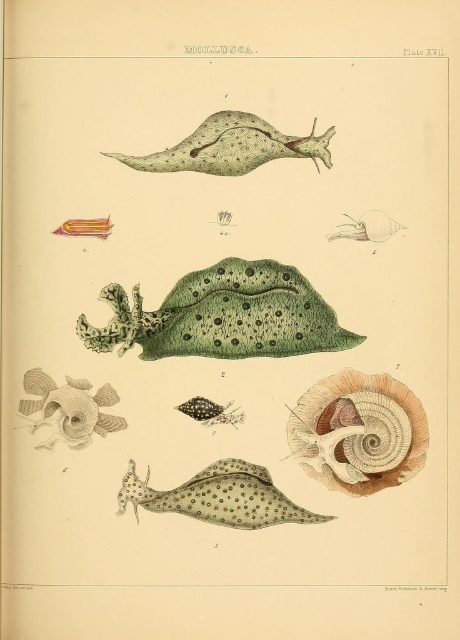
You are examining the scientific illustration of mollusks labeled as Plate XVII. You notice two points marked in the image at coordinates point (x=283, y=298) and point (x=340, y=481). Which of these points is closer to the viewer?

Point (x=283, y=298) is closer to the viewer than point (x=340, y=481) because it is further to the camera.

In the scientific illustration labeled as Plate XVII under the Mollusca section, you observe two slugs labeled as green matte slug at center and speckled green slug at upper center. Based on their positions in the image, which slug is located higher up?

The speckled green slug at upper center is positioned higher up in the illustration compared to the green matte slug at center, which is situated below it.